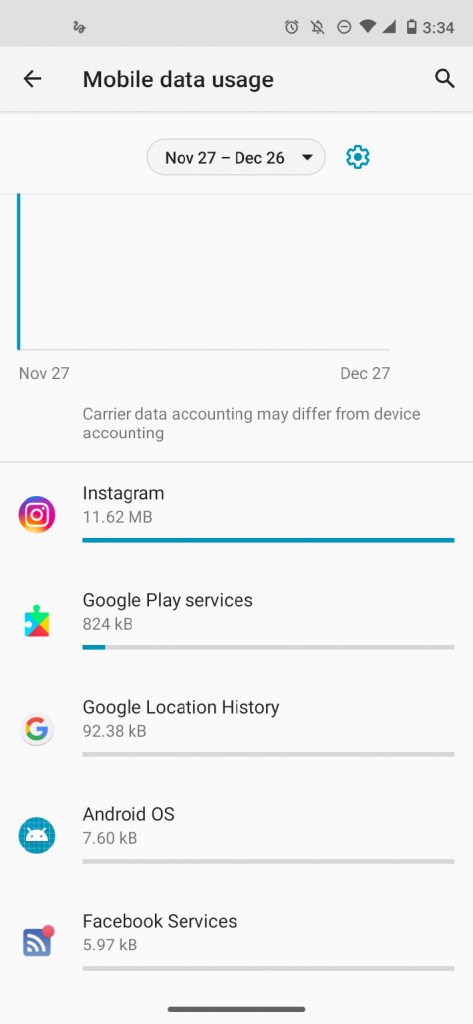
Identify the location of alarm. The width and height of the screenshot is (473, 1024). (319, 23).